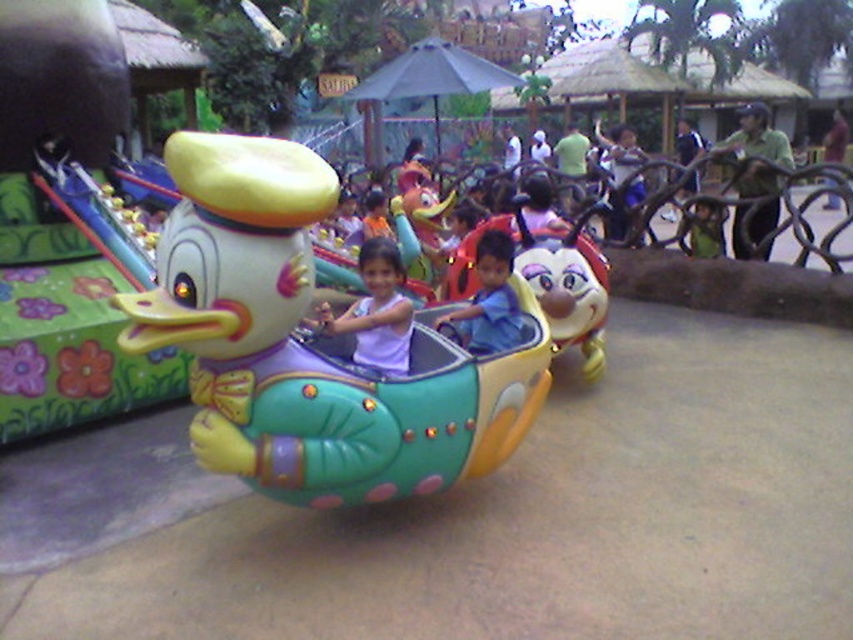
How much distance is there between matte yellow duck at center and matte purple shirt at center?

matte yellow duck at center is 2.29 meters away from matte purple shirt at center.

Can you confirm if matte yellow duck at center is taller than matte purple shirt at center?

Indeed, matte yellow duck at center has a greater height compared to matte purple shirt at center.

You are a GUI agent. You are given a task and a screenshot of the screen. Output one action in this format:
    pyautogui.click(x=<x>, y=<y>)
    Task: Click on the matte yellow duck at center
    The image size is (853, 640).
    Given the screenshot: What is the action you would take?
    pyautogui.click(x=62, y=227)

Is point (3, 212) closer to camera compared to point (496, 250)?

No, (3, 212) is further to viewer.

What do you see at coordinates (62, 227) in the screenshot? I see `matte yellow duck at center` at bounding box center [62, 227].

The image size is (853, 640). In order to click on matte yellow duck at center in this screenshot , I will do `click(62, 227)`.

Who is lower down, matte yellow duck at center or shiny plastic bee at center?

shiny plastic bee at center is lower down.

This screenshot has height=640, width=853. What do you see at coordinates (62, 227) in the screenshot? I see `matte yellow duck at center` at bounding box center [62, 227].

Image resolution: width=853 pixels, height=640 pixels. I want to click on matte yellow duck at center, so click(62, 227).